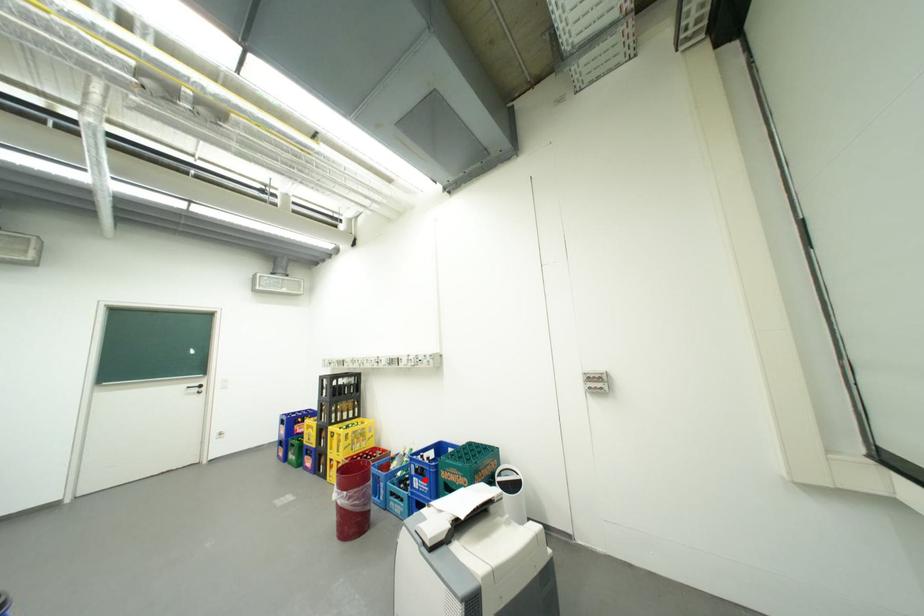
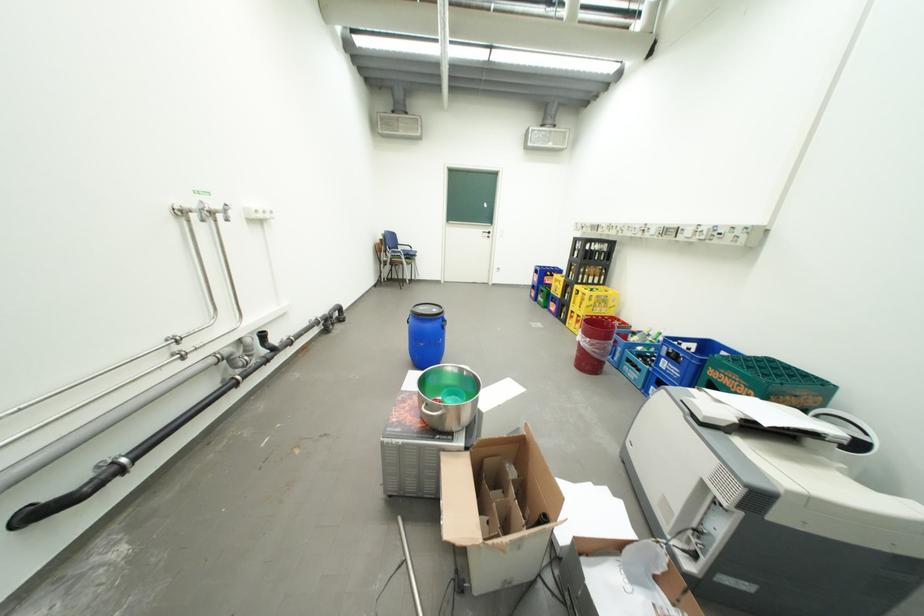
Question: I am providing you with two images of the same scene from different viewpoints. A red point is shown in image1. For the corresponding object point in image2, is it positioned nearer or farther from the camera?

Choices:
 (A) Nearer
 (B) Farther

Answer: (A)